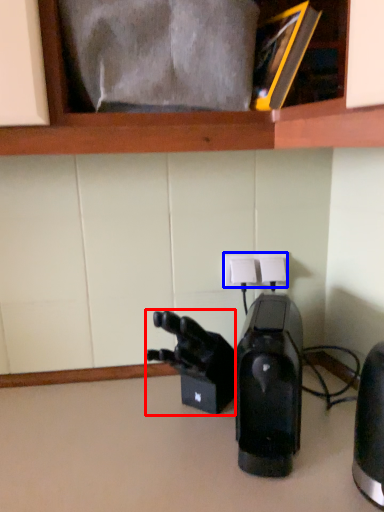
Question: Which point is further to the camera, video camera (highlighted by a red box) or electric outlet (highlighted by a blue box)?

Choices:
 (A) video camera
 (B) electric outlet

Answer: (B)